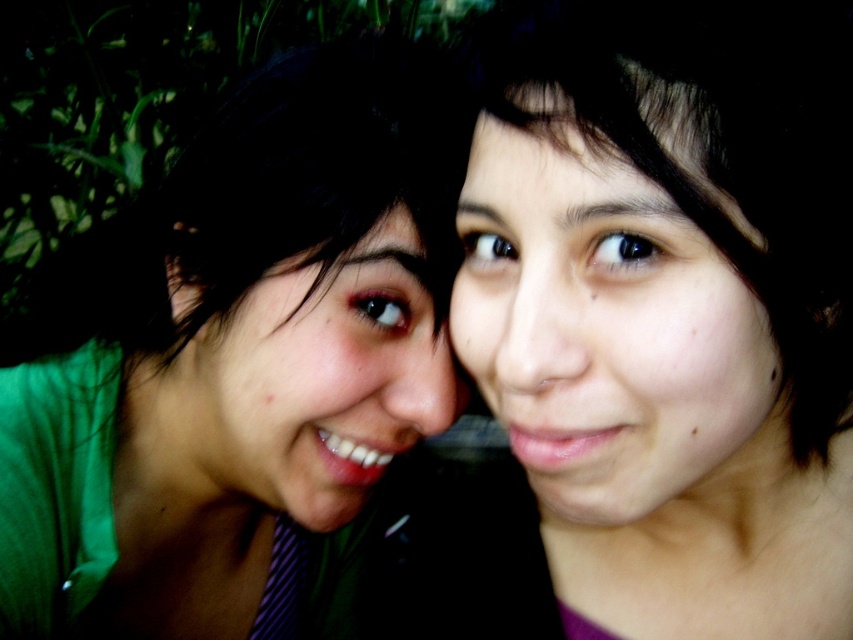
You are a photographer trying to adjust the lighting for a photo shoot. You notice two shirts in the scene, the green matte shirt at left and the matte green shirt at center. Which shirt should you position closer to the light source to ensure it stands out more?

The green matte shirt at left is taller than the matte green shirt at center, so positioning the taller green matte shirt at left closer to the light source will make it stand out more due to its height advantage.

You are a photographer trying to capture a portrait of the two people in the image. You want to ensure that both the green matte shirt at left and the smooth skin face at center are in focus. Given that your camera has a depth of field that can cover 20 centimeters, will both subjects be in focus?

The distance between the green matte shirt at left and the smooth skin face at center is 19.44 centimeters, which is within the camera depth of field of 20 centimeters. Therefore, both subjects will be in focus.

You are a photographer standing in front of the scene. You want to focus on the green matte shirt at left. Where should you aim your camera to capture it?

The green matte shirt at left is located at the 2D coordinates point (234, 369), so you should aim your camera at that point to capture it.